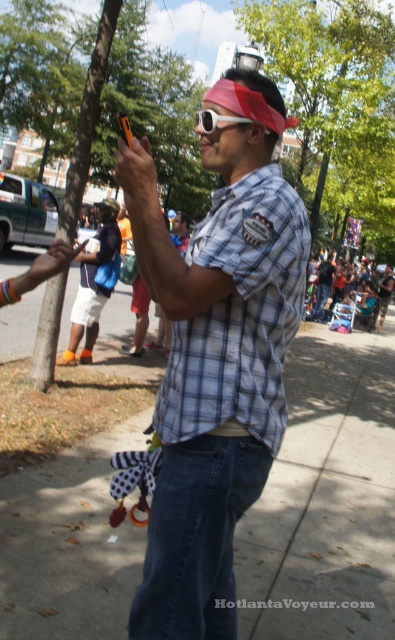
You are standing at the origin point of the coordinate system. You want to walk to the smooth concrete sidewalk at center. Which direction should you walk to reach it?

The smooth concrete sidewalk at center is located at coordinate point (327, 497), so you should walk towards the northeast direction to reach it.

You are a photographer trying to capture the scene. The gray checkered shirt at center and the matte black phone at center are both in your viewfinder. Which object should you focus on if you want to capture the larger one in your photo?

The matte black phone at center is larger, so you should focus on it to capture the larger object.